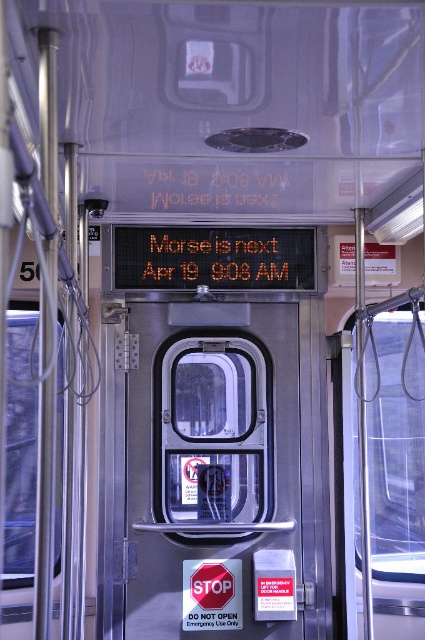
You are a passenger waiting to board the vehicle. You see the transparent glass door at center and the translucent plastic text at center. Which object is closer to you as you approach the door?

The transparent glass door at center is closer to you because the translucent plastic text at center is behind it.

You are a passenger trying to board the vehicle and see the transparent glass door at center and the orange digital text at center. Which object is wider?

The transparent glass door at center is wider than the orange digital text at center.

You are a passenger on a bus and see the orange digital text at center and the translucent plastic text at center above the door. Which text is taller?

The orange digital text at center is taller than the translucent plastic text at center.